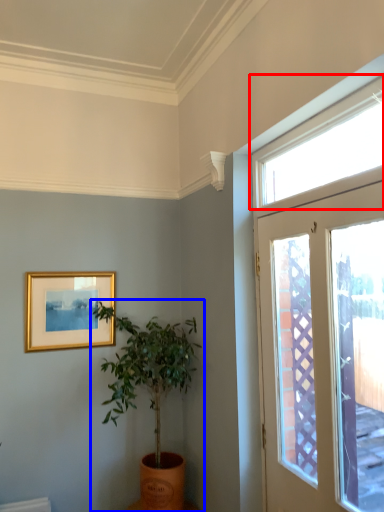
Question: Which object is further to the camera taking this photo, window (highlighted by a red box) or houseplant (highlighted by a blue box)?

Choices:
 (A) window
 (B) houseplant

Answer: (B)